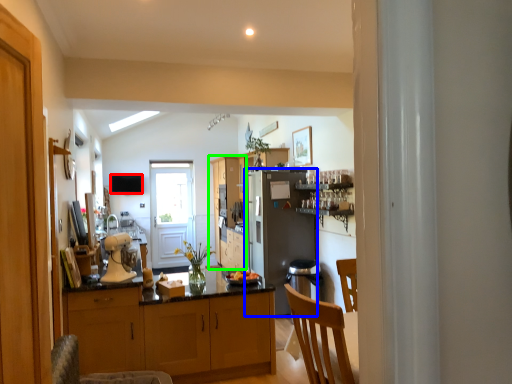
Question: Which object is the farthest from television (highlighted by a red box)? Choose among these: refrigerator (highlighted by a blue box) or cabinetry (highlighted by a green box).

Choices:
 (A) refrigerator
 (B) cabinetry

Answer: (A)